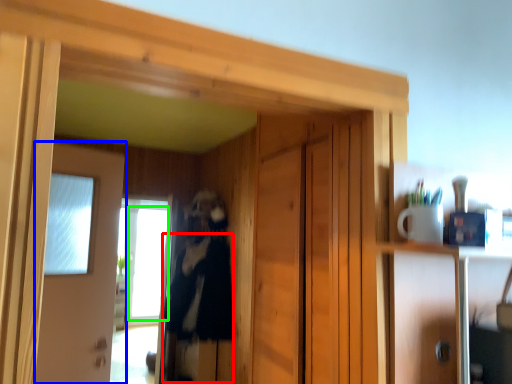
Question: Which object is positioned farthest from clothing (highlighted by a red box)? Select from door (highlighted by a blue box) and window (highlighted by a green box).

Choices:
 (A) door
 (B) window

Answer: (B)